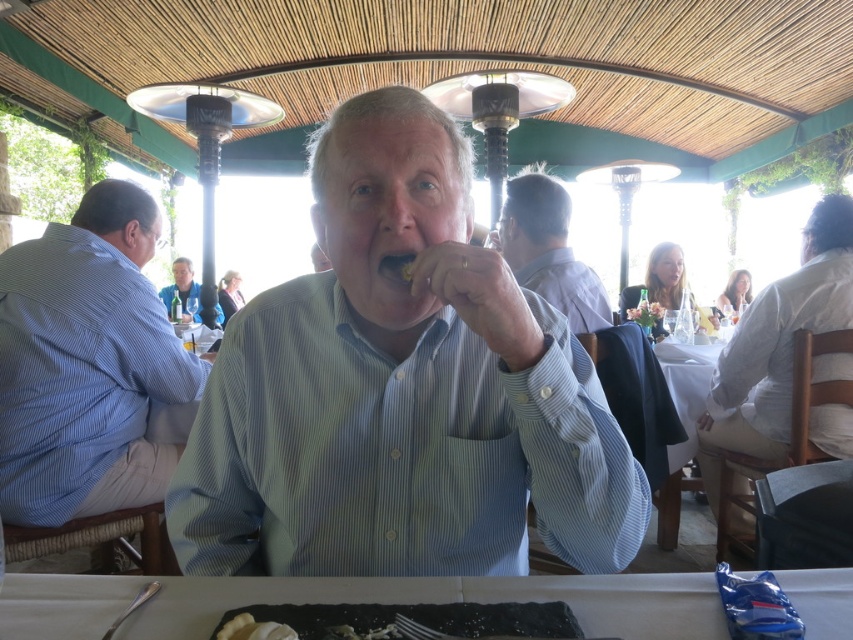
You are a photographer standing behind the table in the scene. You want to take a photo of the blue shirt at center without the white cotton shirt at right appearing in the frame. Is this possible given their positions?

The white cotton shirt at right is positioned under the blue shirt at center, so it might be challenging to capture the blue shirt at center without the white cotton shirt at right appearing in the frame. Adjusting the camera angle slightly upward could help exclude the white cotton shirt at right from the shot.

Based on the provided scene description, can you determine the exact coordinates of the white matte table at center?

The white matte table at center is located at coordinates point (351, 602).